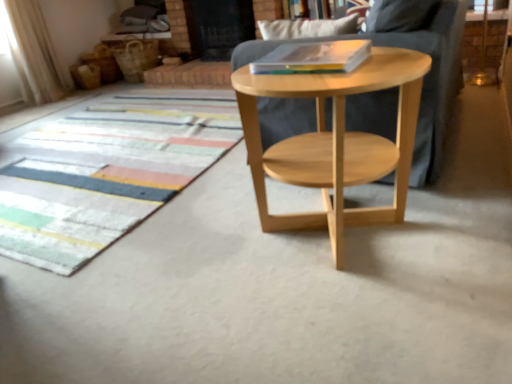
You are a GUI agent. You are given a task and a screenshot of the screen. Output one action in this format:
    pyautogui.click(x=<x>, y=<y>)
    Task: Click on the sheer fabric curtain at upper left
    This screenshot has width=512, height=384.
    Given the screenshot: What is the action you would take?
    pyautogui.click(x=34, y=53)

The image size is (512, 384). What do you see at coordinates (105, 173) in the screenshot?
I see `multicolored woven mat at lower left` at bounding box center [105, 173].

Where is `transparent glass screen door at upper center`? This screenshot has width=512, height=384. transparent glass screen door at upper center is located at coordinates (218, 27).

Identify the location of natural wood side table at center. The height and width of the screenshot is (384, 512). (423, 79).

In order to click on sheer fabric curtain at upper left in this screenshot , I will do `click(34, 53)`.

Are hardcover book at center and transparent glass screen door at upper center beside each other?

There is a gap between hardcover book at center and transparent glass screen door at upper center.

Is point (326, 55) in front of point (249, 27)?

Yes, it is in front of point (249, 27).

Between hardcover book at center and transparent glass screen door at upper center, which one has smaller size?

Smaller between the two is hardcover book at center.

Image resolution: width=512 pixels, height=384 pixels. In the image, there is a transparent glass screen door at upper center. Find the location of `book below it (from the image's perspective)`. book below it (from the image's perspective) is located at coordinates (313, 57).

I want to click on mat on the left side of natural wood side table at center, so click(105, 173).

Considering the sizes of objects natural wood side table at center and multicolored woven mat at lower left in the image provided, who is smaller, natural wood side table at center or multicolored woven mat at lower left?

With smaller size is multicolored woven mat at lower left.

Is natural wood side table at center at the right side of multicolored woven mat at lower left?

Indeed, natural wood side table at center is positioned on the right side of multicolored woven mat at lower left.

From the image's perspective, which is above, transparent glass screen door at upper center or hardcover book at center?

transparent glass screen door at upper center, from the image's perspective.

Does transparent glass screen door at upper center turn towards hardcover book at center?

No.

Is transparent glass screen door at upper center behind hardcover book at center?

Yes, transparent glass screen door at upper center is behind hardcover book at center.

Could hardcover book at center be considered to be inside transparent glass screen door at upper center?

Actually, hardcover book at center is outside transparent glass screen door at upper center.

From a real-world perspective, relative to hardcover book at center, is natural wood side table at center vertically above or below?

Clearly, from a real-world perspective, natural wood side table at center is below hardcover book at center.

In the scene shown: From the image's perspective, is natural wood side table at center positioned above or below hardcover book at center?

natural wood side table at center is situated higher than hardcover book at center in the image.

Considering the sizes of objects natural wood side table at center and hardcover book at center in the image provided, who is bigger, natural wood side table at center or hardcover book at center?

natural wood side table at center is bigger.

Does point (419, 149) come closer to viewer compared to point (336, 44)?

No, (419, 149) is behind (336, 44).

Which point is more distant from viewer, (250, 33) or (1, 208)?

The point (250, 33) is behind.

Is transparent glass screen door at upper center positioned in front of multicolored woven mat at lower left?

No, the depth of transparent glass screen door at upper center is greater than that of multicolored woven mat at lower left.

Based on the photo, from the image's perspective, which is below, transparent glass screen door at upper center or multicolored woven mat at lower left?

From the image's view, multicolored woven mat at lower left is below.

In the image, there is a transparent glass screen door at upper center. At what (x,y) coordinates should I click in order to perform the action: click on mat below it (from the image's perspective). Please return your answer as a coordinate pair (x, y). This screenshot has height=384, width=512. Looking at the image, I should click on (105, 173).

Could you measure the distance between multicolored woven mat at lower left and transparent glass screen door at upper center?

A distance of 6.74 feet exists between multicolored woven mat at lower left and transparent glass screen door at upper center.

Does point (137, 108) appear closer or farther from the camera than point (211, 18)?

Point (137, 108).

From a real-world perspective, which is physically below, multicolored woven mat at lower left or transparent glass screen door at upper center?

multicolored woven mat at lower left.

Locate an element on the screen. The height and width of the screenshot is (384, 512). curtain behind the natural wood side table at center is located at coordinates (34, 53).

Which of these two, sheer fabric curtain at upper left or natural wood side table at center, is thinner?

With smaller width is sheer fabric curtain at upper left.

Is sheer fabric curtain at upper left positioned far away from natural wood side table at center?

sheer fabric curtain at upper left is positioned a significant distance from natural wood side table at center.

Is sheer fabric curtain at upper left taller than natural wood side table at center?

Yes, sheer fabric curtain at upper left is taller than natural wood side table at center.

Locate an element on the screen. screen door on the left of hardcover book at center is located at coordinates (218, 27).

Locate an element on the screen. This screenshot has height=384, width=512. chair lying on the right of multicolored woven mat at lower left is located at coordinates (423, 79).

Considering their positions, is hardcover book at center positioned further to multicolored woven mat at lower left than natural wood side table at center?

hardcover book at center is positioned further to the anchor multicolored woven mat at lower left.

From the image, which object appears to be farther from hardcover book at center, natural wood side table at center or multicolored woven mat at lower left?

multicolored woven mat at lower left.

Based on their spatial positions, is natural wood side table at center or multicolored woven mat at lower left closer to natural wood side table at center?

natural wood side table at center is closer to natural wood side table at center.

Estimate the real-world distances between objects in this image. Which object is closer to multicolored woven mat at lower left, transparent glass screen door at upper center or natural wood side table at center?

natural wood side table at center lies closer to multicolored woven mat at lower left than the other object.

Considering their positions, is hardcover book at center positioned further to multicolored woven mat at lower left than sheer fabric curtain at upper left?

sheer fabric curtain at upper left.

Considering their positions, is sheer fabric curtain at upper left positioned further to hardcover book at center than natural wood side table at center?

sheer fabric curtain at upper left is positioned further to the anchor hardcover book at center.

When comparing their distances from sheer fabric curtain at upper left, does natural wood side table at center or hardcover book at center seem closer?

Based on the image, hardcover book at center appears to be nearer to sheer fabric curtain at upper left.

From the image, which object appears to be nearer to transparent glass screen door at upper center, sheer fabric curtain at upper left or natural wood side table at center?

Among the two, sheer fabric curtain at upper left is located nearer to transparent glass screen door at upper center.

Where is `book located between natural wood side table at center and transparent glass screen door at upper center in the depth direction`? book located between natural wood side table at center and transparent glass screen door at upper center in the depth direction is located at coordinates (313, 57).

Locate an element on the screen. mat between natural wood side table at center and transparent glass screen door at upper center in the front-back direction is located at coordinates (105, 173).

I want to click on curtain between hardcover book at center and transparent glass screen door at upper center from front to back, so click(x=34, y=53).

Locate an element on the screen. This screenshot has height=384, width=512. chair between hardcover book at center and transparent glass screen door at upper center from front to back is located at coordinates (423, 79).